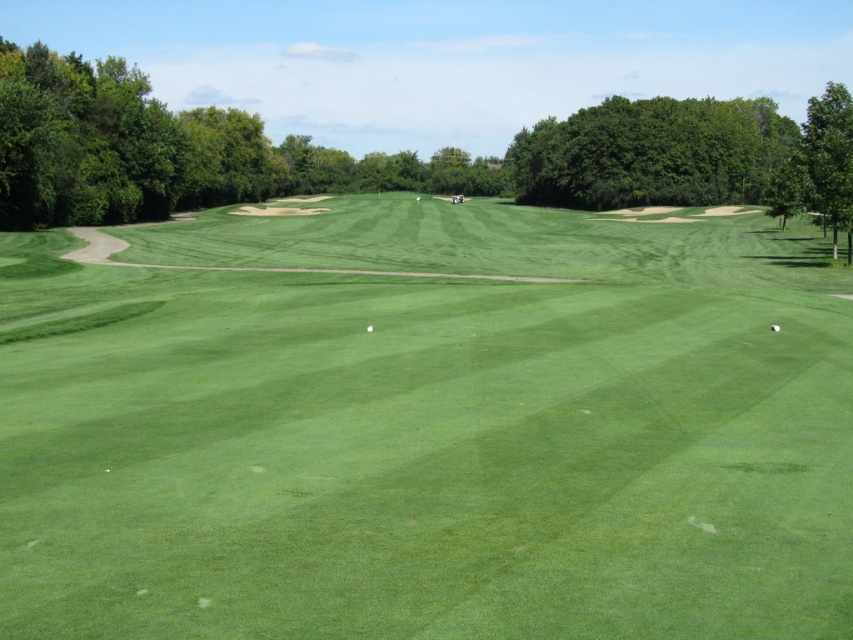
Question: Is green leafy tree at upper right thinner than green leafy tree at right?

Choices:
 (A) no
 (B) yes

Answer: (B)

Question: Which is nearer to the green smooth golf ball at center?

Choices:
 (A) green leafy tree at upper right
 (B) green leafy tree at right
 (C) green grassy field at center

Answer: (C)

Question: Which of these objects is positioned closest to the green smooth golf ball at lower right?

Choices:
 (A) green grassy field at center
 (B) green smooth golf ball at center
 (C) green leafy tree at upper right
 (D) green leafy tree at right

Answer: (B)

Question: Which object is the closest to the green leafy tree at upper right?

Choices:
 (A) green leafy tree at right
 (B) green grassy field at center
 (C) green smooth golf ball at lower right

Answer: (A)

Question: Does green leafy tree at upper right come in front of green smooth golf ball at lower right?

Choices:
 (A) yes
 (B) no

Answer: (B)

Question: Can you confirm if green grassy field at center is positioned to the right of green leafy tree at right?

Choices:
 (A) yes
 (B) no

Answer: (B)